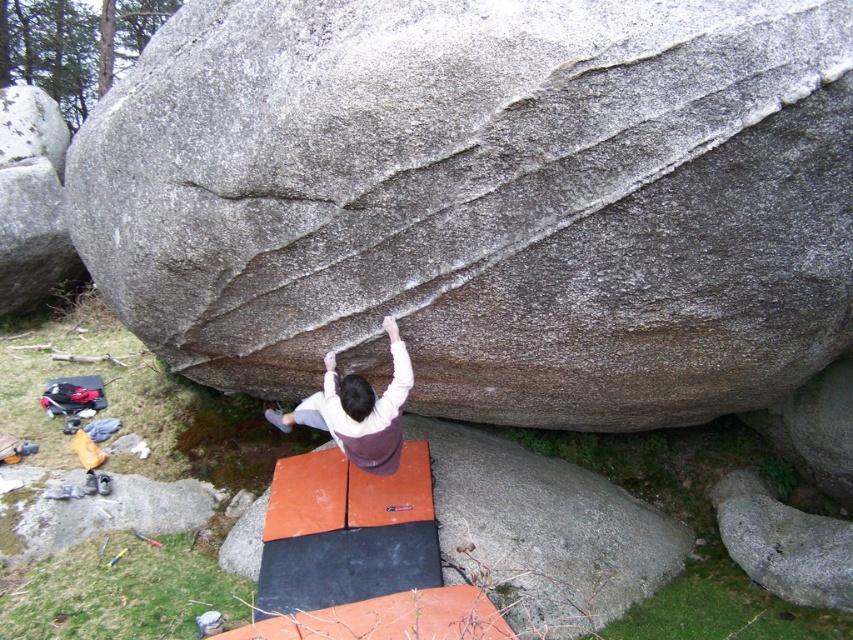
Based on the photo, you are a climber planning to climb the gray textured rock at center. The coordinates of the rock are given as point 0.312, 0.569. If you are standing at the origin point 0,0, which direction should you move to reach the rock?

The gray textured rock at center is located at coordinates (485, 198). Since the x and y values are both positive, you should move northeast to reach the rock.

You are a climber preparing to attempt a bouldering route. You notice the gray textured rock at center and the orange rubber mat at center. Which object is larger in size?

The gray textured rock at center is bigger than the orange rubber mat at center.